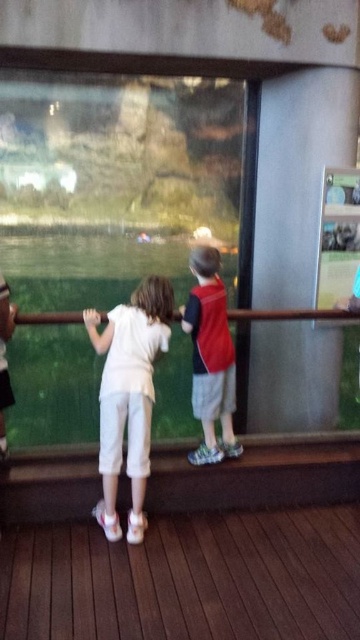
Question: Does white cotton shirt at center have a larger size compared to red fabric backpack at center?

Choices:
 (A) no
 (B) yes

Answer: (B)

Question: Does white cotton shirt at center have a smaller size compared to red fabric backpack at center?

Choices:
 (A) no
 (B) yes

Answer: (A)

Question: Which point appears farthest from the camera in this image?

Choices:
 (A) (105, 404)
 (B) (218, 339)

Answer: (B)

Question: Which point is closer to the camera?

Choices:
 (A) (151, 332)
 (B) (218, 320)

Answer: (A)

Question: Is white cotton shirt at center bigger than red fabric backpack at center?

Choices:
 (A) no
 (B) yes

Answer: (B)